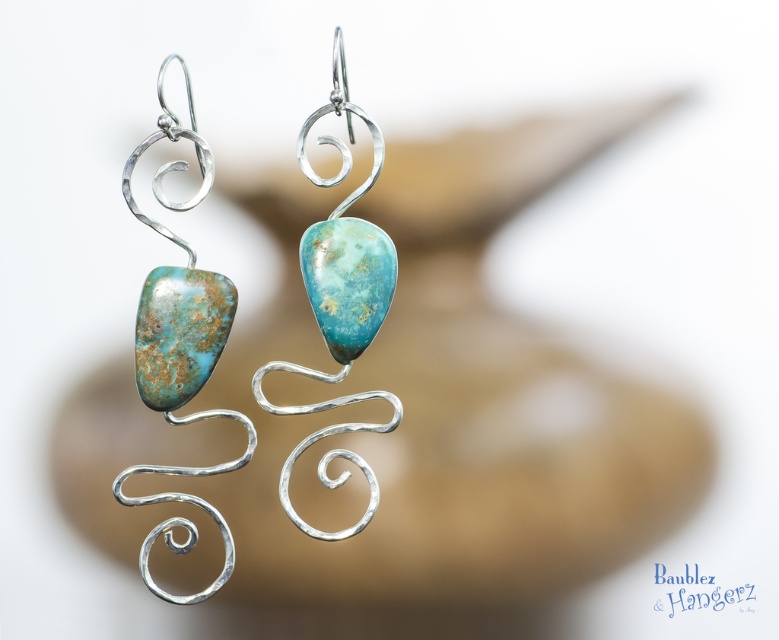
You are an appraiser examining the earrings. You need to determine the placement of the turquoise stones. According to the image, where is the turquoise stone at left relative to the turquoise stone pendant at center?

The turquoise stone at left is positioned under the turquoise stone pendant at center.

You are an artisan examining the earrings. You need to determine the position of the turquoise stone at left relative to the matte silver wire at center. Which object is positioned lower?

The turquoise stone at left is positioned below the matte silver wire at center, so the turquoise stone at left is lower.